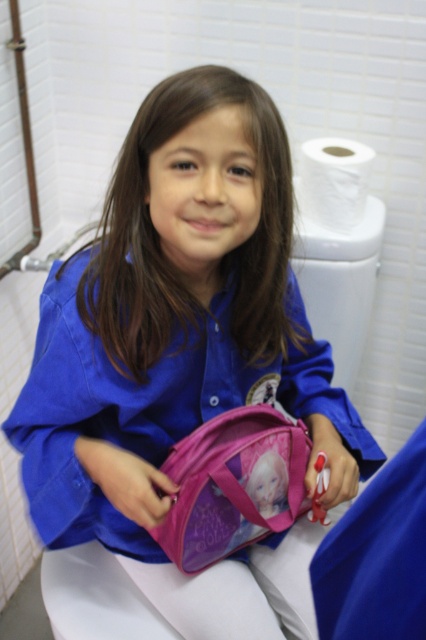
Question: Does pink fabric scrub at lower right have a lesser width compared to white matte toilet paper at upper right?

Choices:
 (A) yes
 (B) no

Answer: (A)

Question: Is pink fabric backpack at lower center below pink fabric scrub at lower right?

Choices:
 (A) yes
 (B) no

Answer: (A)

Question: Does pink fabric backpack at lower center appear over white matte toilet paper at upper right?

Choices:
 (A) yes
 (B) no

Answer: (B)

Question: Based on their relative distances, which object is farther from the pink fabric backpack at lower center?

Choices:
 (A) white matte toilet paper at upper right
 (B) pink fabric scrub at lower right

Answer: (A)

Question: Which is nearer to the pink fabric backpack at lower center?

Choices:
 (A) pink fabric scrub at lower right
 (B) white matte toilet paper at upper right

Answer: (A)

Question: Considering the real-world distances, which object is farthest from the white matte toilet paper at upper right?

Choices:
 (A) pink fabric scrub at lower right
 (B) pink fabric backpack at lower center

Answer: (A)